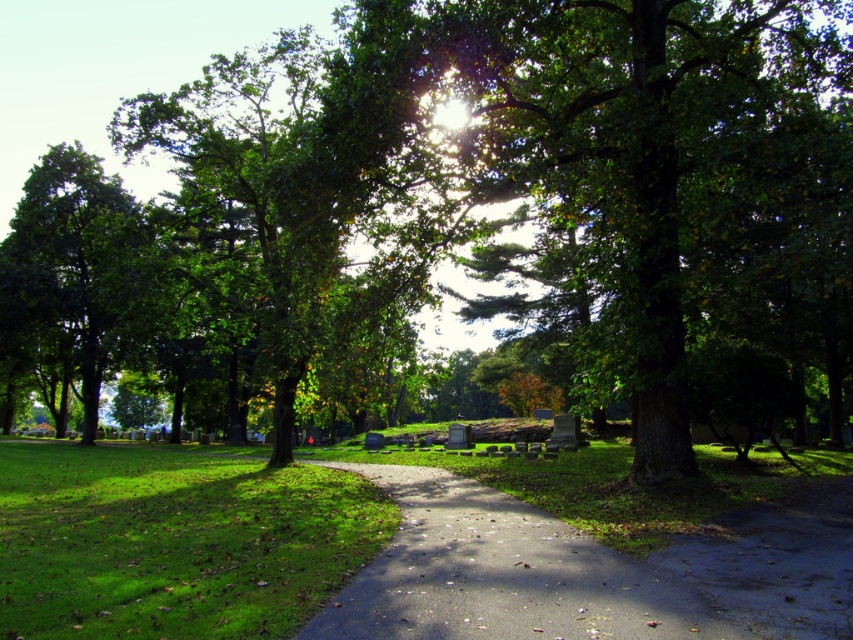
Where is `asphalt path at center`? The image size is (853, 640). asphalt path at center is located at coordinates (502, 573).

Where is `asphalt path at center`? This screenshot has width=853, height=640. asphalt path at center is located at coordinates point(502,573).

Between green grassy at center and asphalt path at center, which one is positioned higher?

asphalt path at center is higher up.

Who is positioned more to the left, green grassy at center or asphalt path at center?

Positioned to the left is green grassy at center.

Locate an element on the screen. green grassy at center is located at coordinates (173, 541).

Where is `green grassy at center`? green grassy at center is located at coordinates (173, 541).

Which is above, green grassy at center or green leafy tree at left?

Positioned higher is green leafy tree at left.

Image resolution: width=853 pixels, height=640 pixels. Find the location of `green grassy at center`. green grassy at center is located at coordinates (173, 541).

Does point (318, 488) lie in front of point (102, 332)?

Yes.

I want to click on green grassy at center, so point(173,541).